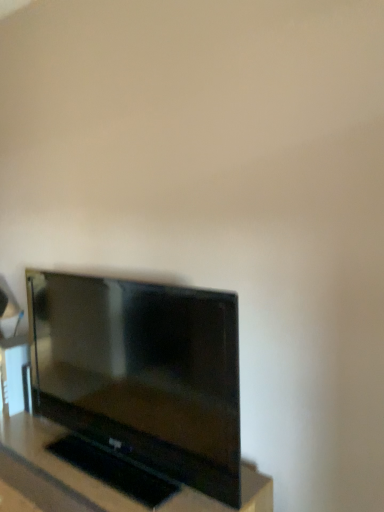
In order to face matte black tv at lower left, should I rotate leftwards or rightwards?

Turn left by 11.276 degrees to look at matte black tv at lower left.

The image size is (384, 512). What do you see at coordinates (141, 372) in the screenshot?
I see `matte black tv at lower left` at bounding box center [141, 372].

What is the approximate width of matte black tv at lower left?

6.95 inches.

Locate an element on the screen. matte black tv at lower left is located at coordinates (141, 372).

Measure the distance between point (106, 425) and camera.

4.88 feet.

Identify the location of black glossy tv at center. The width and height of the screenshot is (384, 512). (58, 461).

This screenshot has height=512, width=384. Describe the element at coordinates (58, 461) in the screenshot. I see `black glossy tv at center` at that location.

Locate an element on the screen. The width and height of the screenshot is (384, 512). matte black tv at lower left is located at coordinates (141, 372).

Which is more to the left, black glossy tv at center or matte black tv at lower left?

black glossy tv at center.

Considering their positions, is black glossy tv at center located in front of or behind matte black tv at lower left?

black glossy tv at center is positioned closer to the viewer than matte black tv at lower left.

Which point is more forward, (43,461) or (206,303)?

The point (206,303) is in front.

Looking at this image, from the image's perspective, which is above, black glossy tv at center or matte black tv at lower left?

matte black tv at lower left.

From a real-world perspective, is black glossy tv at center under matte black tv at lower left?

Yes, from a real-world perspective, black glossy tv at center is below matte black tv at lower left.

Which object is thinner, black glossy tv at center or matte black tv at lower left?

matte black tv at lower left.

Can you confirm if black glossy tv at center is shorter than matte black tv at lower left?

Incorrect, the height of black glossy tv at center does not fall short of that of matte black tv at lower left.

Which of these two, black glossy tv at center or matte black tv at lower left, is smaller?

Smaller between the two is matte black tv at lower left.

Would you say black glossy tv at center is outside matte black tv at lower left?

Indeed, black glossy tv at center is completely outside matte black tv at lower left.

Is black glossy tv at center in contact with matte black tv at lower left?

No, black glossy tv at center is not making contact with matte black tv at lower left.

Could you tell me if black glossy tv at center is turned towards matte black tv at lower left?

No, black glossy tv at center does not turn towards matte black tv at lower left.

What's the angular difference between black glossy tv at center and matte black tv at lower left's facing directions?

The facing directions of black glossy tv at center and matte black tv at lower left are 0.62 degrees apart.

In the scene shown: How far apart are black glossy tv at center and matte black tv at lower left?

29.48 centimeters.

Find the location of a particular element. Image resolution: width=384 pixels, height=512 pixels. television on the right of black glossy tv at center is located at coordinates (141, 372).

Considering the relative positions of matte black tv at lower left and black glossy tv at center in the image provided, is matte black tv at lower left to the left of black glossy tv at center from the viewer's perspective?

No, matte black tv at lower left is not to the left of black glossy tv at center.

Relative to black glossy tv at center, is matte black tv at lower left in front or behind?

matte black tv at lower left is positioned farther from the viewer than black glossy tv at center.

Is point (185, 448) closer to camera compared to point (254, 485)?

Yes.

From the image's perspective, who appears lower, matte black tv at lower left or black glossy tv at center?

From the image's view, black glossy tv at center is below.

From a real-world perspective, is matte black tv at lower left on top of black glossy tv at center?

Yes, from a real-world perspective, matte black tv at lower left is over black glossy tv at center

In terms of width, does matte black tv at lower left look wider or thinner when compared to black glossy tv at center?

In the image, matte black tv at lower left appears to be more narrow than black glossy tv at center.

Consider the image. Who is shorter, matte black tv at lower left or black glossy tv at center?

With less height is matte black tv at lower left.

Which of these two, matte black tv at lower left or black glossy tv at center, is bigger?

With larger size is black glossy tv at center.

Is matte black tv at lower left not within black glossy tv at center?

That's correct, matte black tv at lower left is outside of black glossy tv at center.

Are matte black tv at lower left and black glossy tv at center located far from each other?

No.

Is matte black tv at lower left oriented away from black glossy tv at center?

matte black tv at lower left does not have its back to black glossy tv at center.

How many degrees apart are the facing directions of matte black tv at lower left and black glossy tv at center?

matte black tv at lower left and black glossy tv at center are facing 0.62 degrees away from each other.

Locate an element on the screen. This screenshot has height=512, width=384. furniture in front of the matte black tv at lower left is located at coordinates (58, 461).

You are a GUI agent. You are given a task and a screenshot of the screen. Output one action in this format:
    pyautogui.click(x=<x>, y=<y>)
    Task: Click on the television above the black glossy tv at center (from a real-world perspective)
    
    Given the screenshot: What is the action you would take?
    pyautogui.click(x=141, y=372)

Locate an element on the screen. The image size is (384, 512). television that appears behind the black glossy tv at center is located at coordinates (141, 372).